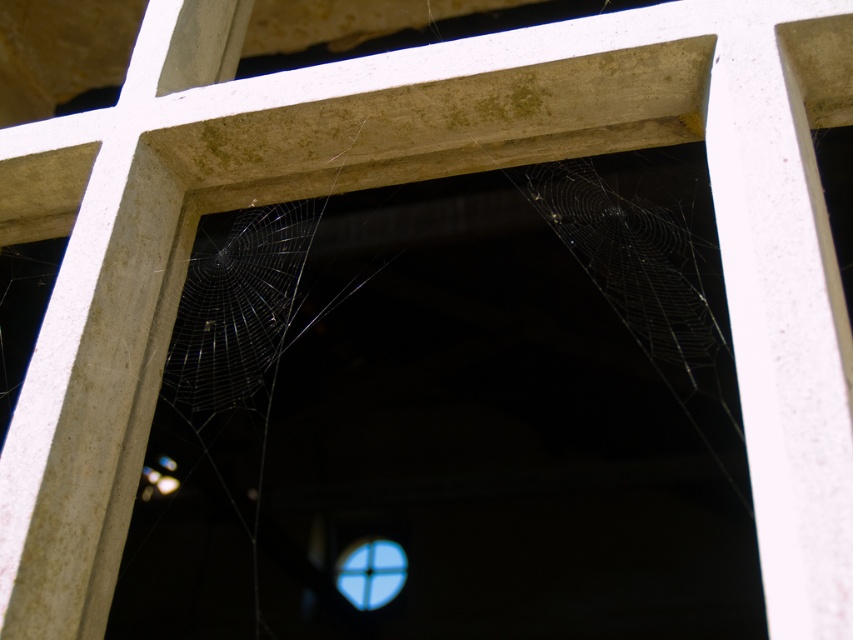
You are examining a spider web through a camera lens. The web is between two points labeled point (224, 278) and point (344, 552). Which point is nearer to your camera lens?

Point (224, 278) is closer to the camera lens than point (344, 552).

You are a small insect trying to navigate through the transparent silk web at center. To avoid getting stuck, you need to fly around it. Which direction should you fly relative to the web?

The transparent silk web at center is located at point (236, 307), so you should fly away from the center coordinates to avoid getting stuck.

You are a window cleaner who needs to clean the transparent glass window at center without damaging the transparent silk web at center. Is the web too large to avoid while cleaning the window?

The transparent silk web at center is bigger than the transparent glass window at center, so the web extends beyond the window. This means the cleaner cannot clean the window without disturbing the web.